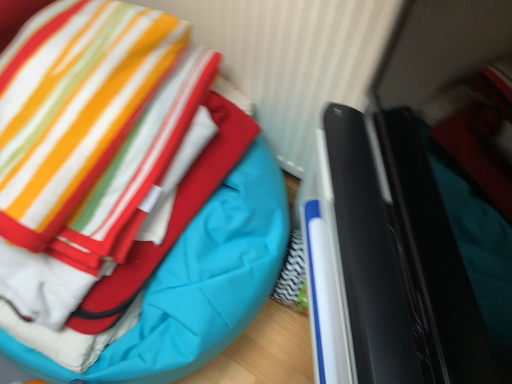
Describe the element at coordinates (387, 257) in the screenshot. The image size is (512, 384). I see `black glossy laptop at right` at that location.

Locate an element on the screen. This screenshot has width=512, height=384. black glossy laptop at right is located at coordinates (387, 257).

From the picture: In order to face black glossy laptop at right, should I rotate leftwards or rightwards?

A 26.493 degree turn to the right will do.

In order to face teal quilted bean bag at center, should I rotate leftwards or rightwards?

A 23.574 degree turn to the left will do.

Identify the location of teal quilted bean bag at center. The width and height of the screenshot is (512, 384). (196, 284).

What do you see at coordinates (196, 284) in the screenshot?
I see `teal quilted bean bag at center` at bounding box center [196, 284].

Identify the location of black glossy laptop at right. pyautogui.click(x=387, y=257).

Between black glossy laptop at right and teal quilted bean bag at center, which one appears on the right side from the viewer's perspective?

black glossy laptop at right is more to the right.

Which object is closer to the camera, black glossy laptop at right or teal quilted bean bag at center?

black glossy laptop at right is in front.

Between point (380, 132) and point (178, 286), which one is positioned in front?

The point (380, 132) is more forward.

From the image's perspective, is black glossy laptop at right above teal quilted bean bag at center?

Incorrect, from the image's perspective, black glossy laptop at right is lower than teal quilted bean bag at center.

From a real-world perspective, which is physically below, black glossy laptop at right or teal quilted bean bag at center?

teal quilted bean bag at center is physically lower.

Between black glossy laptop at right and teal quilted bean bag at center, which one has larger width?

Result: Wider between the two is teal quilted bean bag at center.

Based on the photo, considering the sizes of black glossy laptop at right and teal quilted bean bag at center in the image, is black glossy laptop at right taller or shorter than teal quilted bean bag at center?

Considering their sizes, black glossy laptop at right has less height than teal quilted bean bag at center.

Can you confirm if black glossy laptop at right is bigger than teal quilted bean bag at center?

No, black glossy laptop at right is not bigger than teal quilted bean bag at center.

Do you think black glossy laptop at right is within teal quilted bean bag at center, or outside of it?

The correct answer is: outside.

Are black glossy laptop at right and teal quilted bean bag at center beside each other?

No, black glossy laptop at right is not next to teal quilted bean bag at center.

Is black glossy laptop at right oriented towards teal quilted bean bag at center?

Yes, black glossy laptop at right faces towards teal quilted bean bag at center.

How many degrees apart are the facing directions of black glossy laptop at right and teal quilted bean bag at center?

There is a 57.5-degree angle between the facing directions of black glossy laptop at right and teal quilted bean bag at center.

Locate an element on the screen. This screenshot has height=384, width=512. bean bag chair that appears below the black glossy laptop at right (from a real-world perspective) is located at coordinates (196, 284).

Can you confirm if teal quilted bean bag at center is positioned to the right of black glossy laptop at right?

In fact, teal quilted bean bag at center is to the left of black glossy laptop at right.

Is the depth of teal quilted bean bag at center less than that of black glossy laptop at right?

No, it is behind black glossy laptop at right.

Which is closer to the camera, (234,193) or (340,233)?

Point (234,193) is positioned farther from the camera compared to point (340,233).

From the image's perspective, is teal quilted bean bag at center on black glossy laptop at right?

Yes.

From a real-world perspective, who is located higher, teal quilted bean bag at center or black glossy laptop at right?

In real-world perspective, black glossy laptop at right is above.

Considering the sizes of teal quilted bean bag at center and black glossy laptop at right in the image, is teal quilted bean bag at center wider or thinner than black glossy laptop at right?

teal quilted bean bag at center is wider than black glossy laptop at right.

Is teal quilted bean bag at center shorter than black glossy laptop at right?

In fact, teal quilted bean bag at center may be taller than black glossy laptop at right.

Between teal quilted bean bag at center and black glossy laptop at right, which one has larger size?

With larger size is teal quilted bean bag at center.

In the scene shown: Is black glossy laptop at right a part of teal quilted bean bag at center?

No.

Is teal quilted bean bag at center in contact with black glossy laptop at right?

No, teal quilted bean bag at center is not beside black glossy laptop at right.

Is teal quilted bean bag at center facing away from black glossy laptop at right?

No, teal quilted bean bag at center's orientation is not away from black glossy laptop at right.

What's the angular difference between teal quilted bean bag at center and black glossy laptop at right's facing directions?

There is a 57.5-degree angle between the facing directions of teal quilted bean bag at center and black glossy laptop at right.

You are a GUI agent. You are given a task and a screenshot of the screen. Output one action in this format:
    pyautogui.click(x=<x>, y=<y>)
    Task: Click on the bean bag chair located underneath the black glossy laptop at right (from a real-world perspective)
    The height and width of the screenshot is (384, 512).
    Given the screenshot: What is the action you would take?
    pyautogui.click(x=196, y=284)

Find the location of a particular element. The height and width of the screenshot is (384, 512). laptop on the right of teal quilted bean bag at center is located at coordinates (387, 257).

Locate an element on the screen. This screenshot has width=512, height=384. bean bag chair above the black glossy laptop at right (from the image's perspective) is located at coordinates (196, 284).